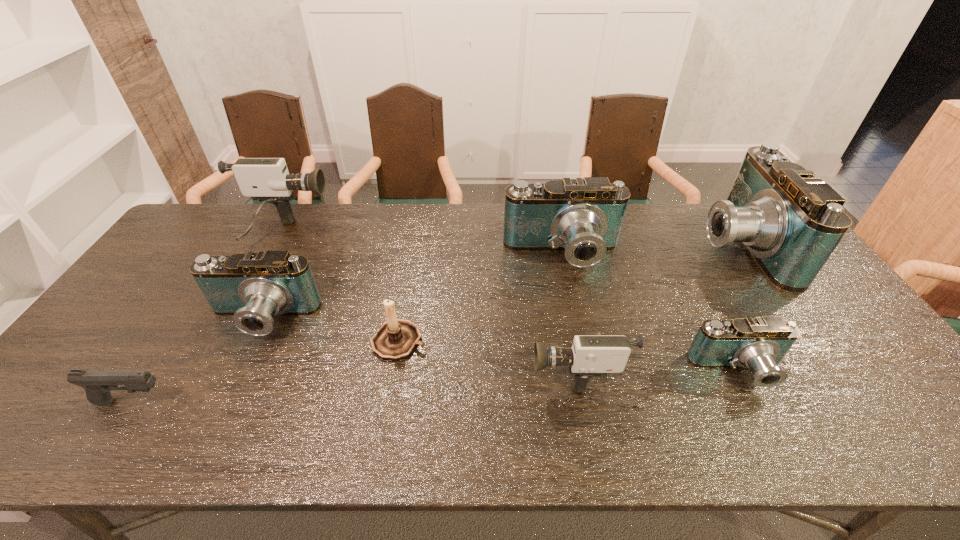
The image size is (960, 540). I want to click on blank space located 0.130m on the recording direction of the smaller white camcorder, so click(477, 369).

Identify the location of vacant space located on the recording direction of the smaller white camcorder. (420, 369).

Find the location of a particular element. The width and height of the screenshot is (960, 540). free space located 0.130m on the front of the fourth object from left to right is located at coordinates (388, 408).

The width and height of the screenshot is (960, 540). In order to click on vacant space located on the front-facing side of the smallest blue camcorder in this screenshot , I will do `click(765, 423)`.

The width and height of the screenshot is (960, 540). In order to click on vacant space situated 0.310m at the barrel of the pistol in this screenshot , I will do `click(303, 402)`.

Where is `object present at the left edge`? object present at the left edge is located at coordinates (97, 384).

Find the location of a particular element. The width and height of the screenshot is (960, 540). object at the right edge is located at coordinates (791, 222).

Locate an element on the screen. object that is at the far right corner is located at coordinates (791, 222).

The height and width of the screenshot is (540, 960). Find the location of `vacant space at the far edge of the desktop`. vacant space at the far edge of the desktop is located at coordinates (671, 213).

I want to click on vacant space at the near edge of the desktop, so click(x=542, y=438).